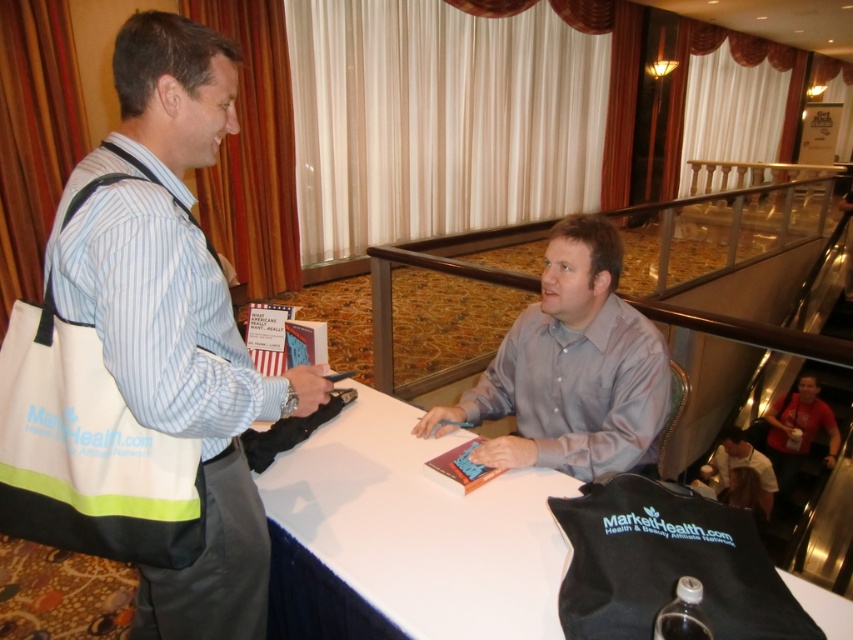
Is white smooth table at center above light gray satin shirt at center?

No.

Does point (837, 614) come in front of point (614, 376)?

Yes, it is.

Locate an element on the screen. white smooth table at center is located at coordinates (421, 525).

From the picture: Is white smooth table at center thinner than light brown leather jacket at lower right?

No.

What do you see at coordinates (421, 525) in the screenshot? The height and width of the screenshot is (640, 853). I see `white smooth table at center` at bounding box center [421, 525].

I want to click on white smooth table at center, so click(421, 525).

Is white canvas tote bag at left bigger than white smooth table at center?

Correct, white canvas tote bag at left is larger in size than white smooth table at center.

Who is higher up, white canvas tote bag at left or white smooth table at center?

white canvas tote bag at left is above.

Between point (120, 65) and point (401, 625), which one is positioned behind?

The point (401, 625) is behind.

Find the location of a particular element. The width and height of the screenshot is (853, 640). white canvas tote bag at left is located at coordinates (180, 320).